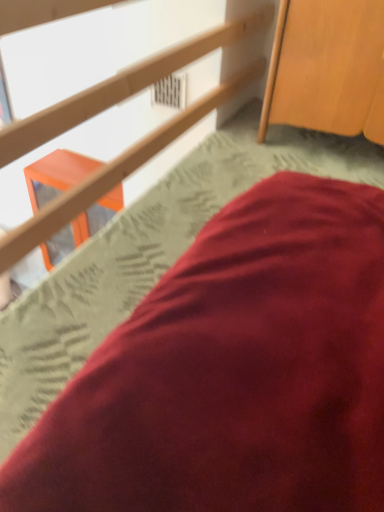
Question: Visually, is satin red pillow at lower right positioned to the left or to the right of wooden cabinet at upper right?

Choices:
 (A) right
 (B) left

Answer: (B)

Question: From a real-world perspective, is satin red pillow at lower right positioned above or below wooden cabinet at upper right?

Choices:
 (A) below
 (B) above

Answer: (A)

Question: Estimate the real-world distances between objects in this image. Which object is farther from the wooden cabinet at upper right?

Choices:
 (A) satin red pillow at lower right
 (B) matte wood rail at upper center

Answer: (A)

Question: Estimate the real-world distances between objects in this image. Which object is farther from the wooden cabinet at upper right?

Choices:
 (A) satin red pillow at lower right
 (B) matte wood rail at upper center

Answer: (A)